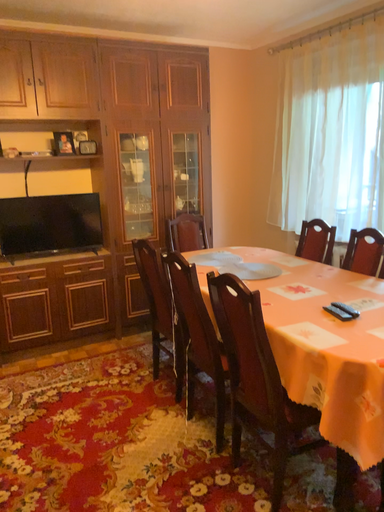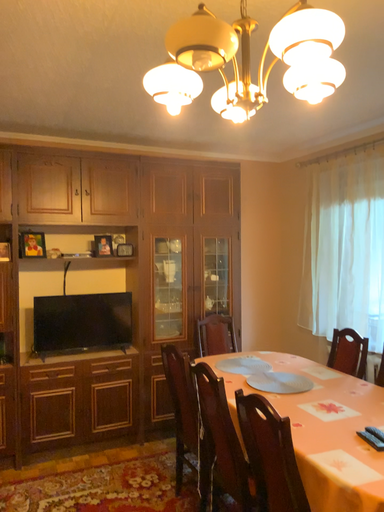
Question: Which way did the camera rotate in the video?

Choices:
 (A) rotated upward
 (B) rotated downward

Answer: (A)